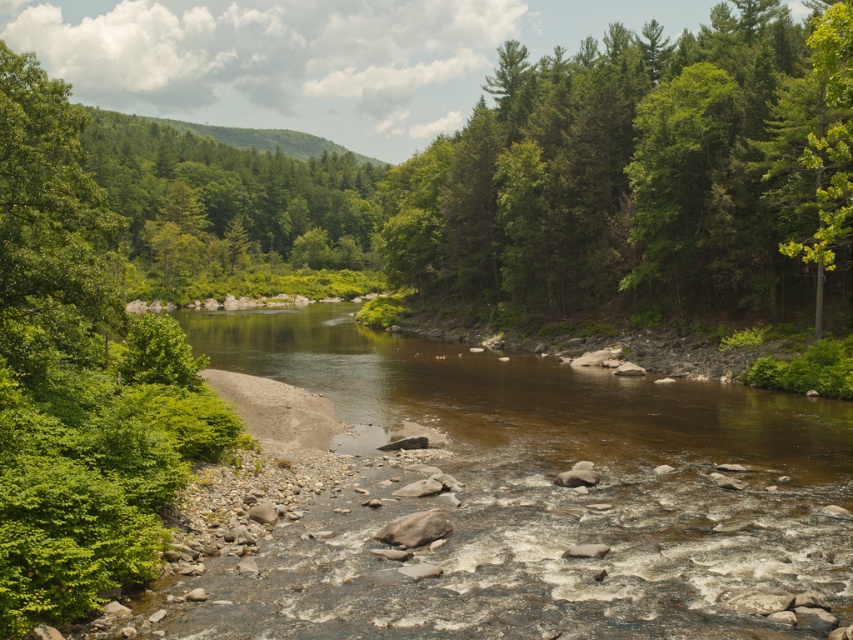
Question: Estimate the real-world distances between objects in this image. Which object is closer to the green leafy tree at center?

Choices:
 (A) brown smooth river at center
 (B) green leafy tree at upper right

Answer: (A)

Question: Is the position of brown smooth river at center more distant than that of green leafy trees at upper right?

Choices:
 (A) no
 (B) yes

Answer: (A)

Question: Among these points, which one is nearest to the camera?

Choices:
 (A) (827, 22)
 (B) (844, 560)
 (C) (183, 268)
 (D) (28, 168)

Answer: (B)

Question: Is green leafy tree at center bigger than green leafy tree at upper left?

Choices:
 (A) yes
 (B) no

Answer: (A)

Question: Does green leafy trees at upper right have a larger size compared to green leafy tree at center?

Choices:
 (A) no
 (B) yes

Answer: (A)

Question: Which object is positioned farthest from the green leafy tree at upper left?

Choices:
 (A) green leafy tree at center
 (B) green leafy tree at upper right
 (C) green leafy trees at upper right
 (D) brown smooth river at center

Answer: (A)